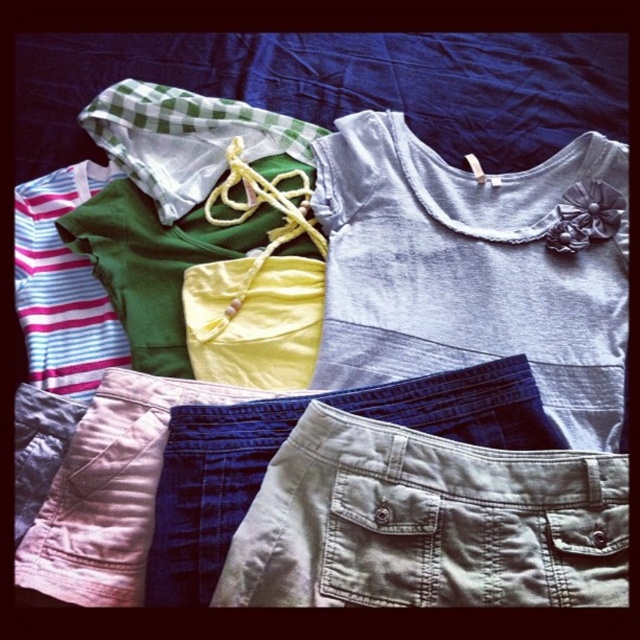
Can you confirm if gray cotton shirt at upper right is positioned to the left of khaki cotton shorts at lower center?

No, gray cotton shirt at upper right is not to the left of khaki cotton shorts at lower center.

Is point (321, 170) less distant than point (284, 579)?

No, (321, 170) is further to viewer.

Does point (344, 204) come in front of point (316, 419)?

No, it is behind (316, 419).

I want to click on gray cotton shirt at upper right, so click(476, 268).